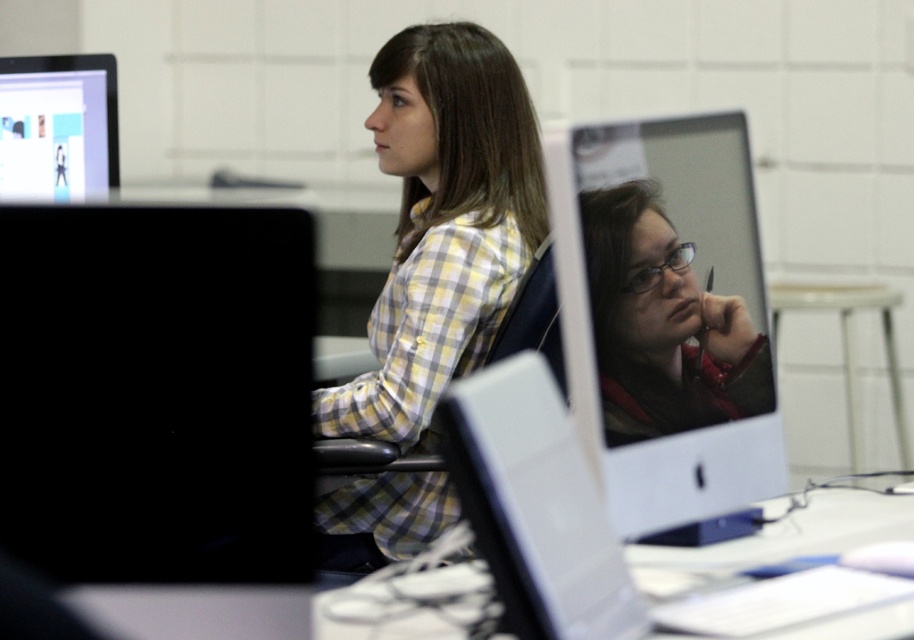
Can you confirm if black matte monitor at left is smaller than matte black monitor at center?

Indeed, black matte monitor at left has a smaller size compared to matte black monitor at center.

Can you confirm if black matte monitor at left is positioned below matte black monitor at center?

Indeed, black matte monitor at left is positioned under matte black monitor at center.

Identify the location of black matte monitor at left. The height and width of the screenshot is (640, 914). (156, 392).

You are a GUI agent. You are given a task and a screenshot of the screen. Output one action in this format:
    pyautogui.click(x=<x>, y=<y>)
    Task: Click on the black matte monitor at left
    Image resolution: width=914 pixels, height=640 pixels.
    Given the screenshot: What is the action you would take?
    pyautogui.click(x=156, y=392)

From the picture: Between black matte monitor at left and matte black monitor at upper left, which one appears on the right side from the viewer's perspective?

From the viewer's perspective, black matte monitor at left appears more on the right side.

Is black matte monitor at left in front of matte black monitor at upper left?

Yes, it is in front of matte black monitor at upper left.

Does point (82, 573) come in front of point (57, 184)?

Yes, point (82, 573) is closer to viewer.

Find the location of a particular element. black matte monitor at left is located at coordinates pyautogui.click(x=156, y=392).

Is point (424, 193) positioned behind point (215, 605)?

Yes, point (424, 193) is behind point (215, 605).

Can you confirm if yellow plaid shirt at center is thinner than white glossy table at center?

Indeed, yellow plaid shirt at center has a lesser width compared to white glossy table at center.

Describe the element at coordinates (442, 225) in the screenshot. I see `yellow plaid shirt at center` at that location.

You are a GUI agent. You are given a task and a screenshot of the screen. Output one action in this format:
    pyautogui.click(x=<x>, y=<y>)
    Task: Click on the yellow plaid shirt at center
    
    Given the screenshot: What is the action you would take?
    pyautogui.click(x=442, y=225)